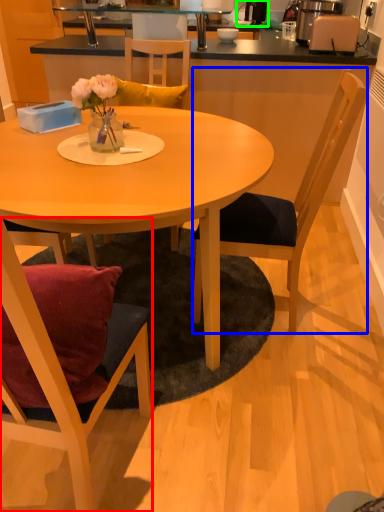
Question: Which is farther away from chair (highlighted by a red box)? chair (highlighted by a blue box) or coffee machine (highlighted by a green box)?

Choices:
 (A) chair
 (B) coffee machine

Answer: (B)